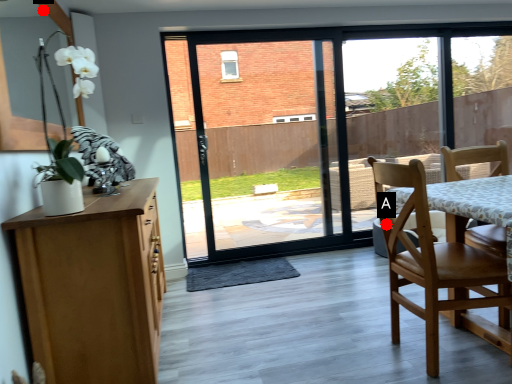
Question: Two points are circled on the image, labeled by A and B beside each circle. Which point appears closest to the camera in this image?

Choices:
 (A) A is closer
 (B) B is closer

Answer: (A)